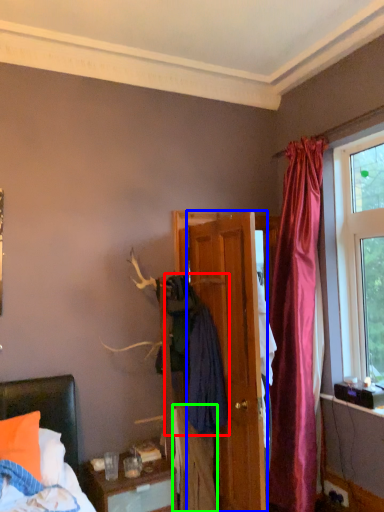
Question: Based on their relative distances, which object is farther from clothing (highlighted by a red box)? Choose from door (highlighted by a blue box) and clothing (highlighted by a green box).

Choices:
 (A) door
 (B) clothing

Answer: (B)